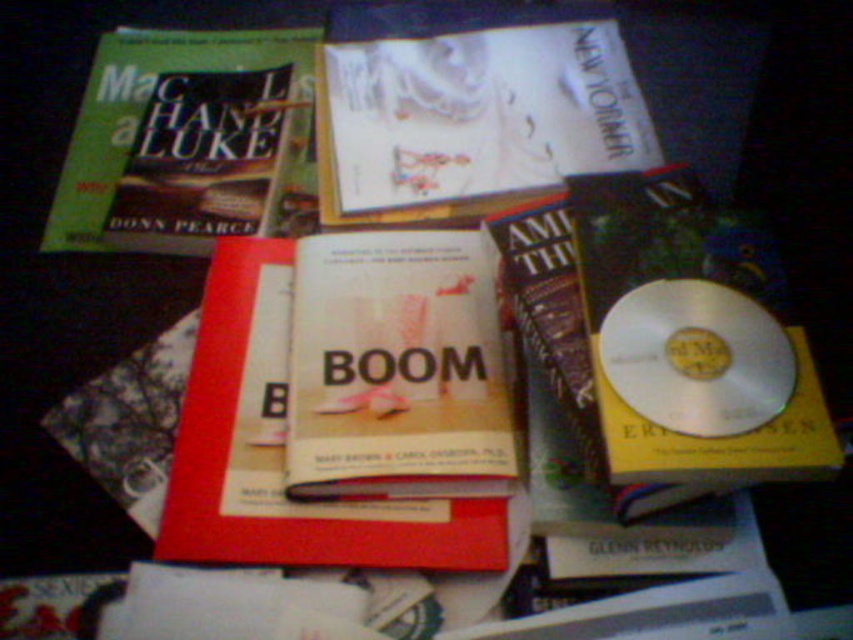
Question: Does white paper magazine at upper center appear on the left side of hardcover book at center?

Choices:
 (A) no
 (B) yes

Answer: (A)

Question: Estimate the real-world distances between objects in this image. Which object is closer to the silver metallic cd at right?

Choices:
 (A) hardcover book at center
 (B) white paper magazine at upper center

Answer: (A)

Question: Does white paper magazine at upper center appear on the right side of hardcover book at center?

Choices:
 (A) yes
 (B) no

Answer: (A)

Question: Which of the following is the closest to the observer?

Choices:
 (A) (544, 28)
 (B) (227, 336)

Answer: (B)

Question: Can you confirm if silver metallic cd at right is thinner than white paper magazine at upper center?

Choices:
 (A) no
 (B) yes

Answer: (B)

Question: Which point is closer to the camera?

Choices:
 (A) white paper magazine at upper center
 (B) silver metallic cd at right
 (C) green matte book at upper left
 (D) hardcover book at center

Answer: (B)